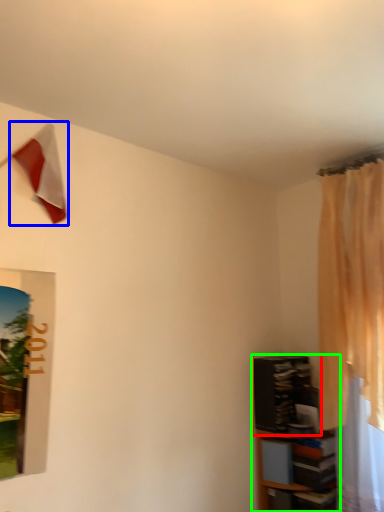
Question: Estimate the real-world distances between objects in this image. Which object is closer to shelf (highlighted by a red box), flag (highlighted by a blue box) or shelf (highlighted by a green box)?

Choices:
 (A) flag
 (B) shelf

Answer: (B)